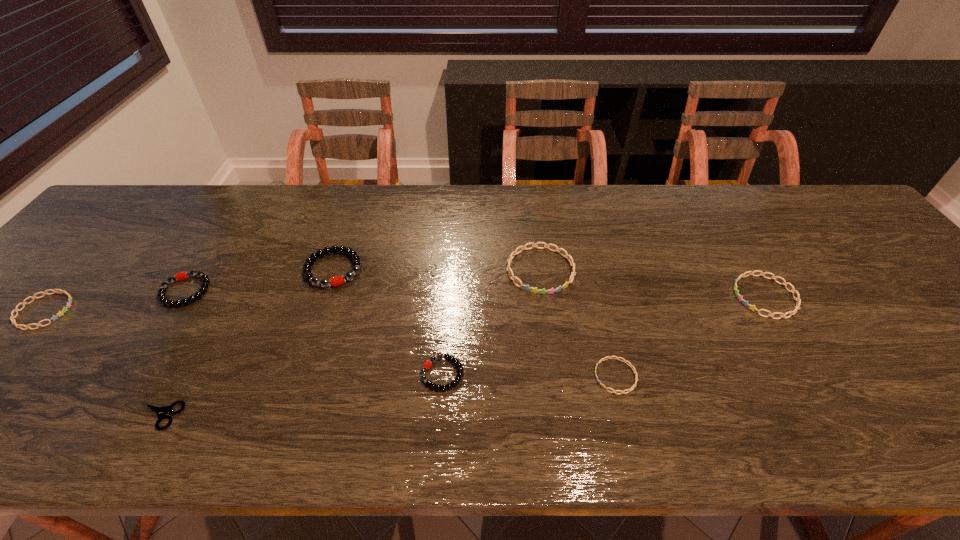
The image size is (960, 540). In order to click on vacant space positioned 0.240m on the right of the second bracelet from left to right in this screenshot , I will do `click(305, 291)`.

What are the coordinates of `vacant space located 0.170m on the surface of the leftmost bracelet showing star-shaped elements` in the screenshot? It's located at (139, 311).

This screenshot has height=540, width=960. Find the location of `free space located on the left of the fourth bracelet from right to left`. free space located on the left of the fourth bracelet from right to left is located at coordinates (276, 374).

Locate an element on the screen. Image resolution: width=960 pixels, height=540 pixels. vacant space situated 0.120m on the surface of the nearest blue bracelet showing star-shaped elements is located at coordinates (539, 376).

You are a GUI agent. You are given a task and a screenshot of the screen. Output one action in this format:
    pyautogui.click(x=<x>, y=<y>)
    Task: Click on the vacant space located 0.200m on the surface of the nearest blue bracelet showing star-shaped elements
    Image resolution: width=960 pixels, height=540 pixels.
    Given the screenshot: What is the action you would take?
    pyautogui.click(x=500, y=376)

Locate an element on the screen. free region located on the surface of the nearest blue bracelet showing star-shaped elements is located at coordinates (547, 376).

Find the location of a particular element. This screenshot has width=960, height=540. vacant space located 0.200m on the left of the nearest object is located at coordinates (35, 416).

Locate an element on the screen. The image size is (960, 540). object that is at the near edge is located at coordinates (161, 412).

Where is `object that is at the left edge`? This screenshot has height=540, width=960. object that is at the left edge is located at coordinates (44, 293).

Identify the location of vacant space at the far edge. (276, 211).